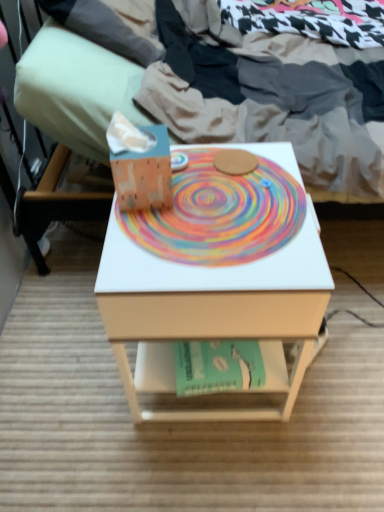
Question: Does matte green pillow at upper left contain rainbow painted paper at center?

Choices:
 (A) yes
 (B) no

Answer: (B)

Question: Does matte green pillow at upper left have a smaller size compared to rainbow painted paper at center?

Choices:
 (A) yes
 (B) no

Answer: (B)

Question: Is matte green pillow at upper left outside rainbow painted paper at center?

Choices:
 (A) yes
 (B) no

Answer: (A)

Question: From a real-world perspective, is matte green pillow at upper left positioned under rainbow painted paper at center based on gravity?

Choices:
 (A) no
 (B) yes

Answer: (A)

Question: Is matte green pillow at upper left positioned behind rainbow painted paper at center?

Choices:
 (A) yes
 (B) no

Answer: (A)

Question: Does matte green pillow at upper left appear on the right side of rainbow painted paper at center?

Choices:
 (A) no
 (B) yes

Answer: (A)

Question: Does matte white bed at center appear on the left side of rainbow painted paper at center?

Choices:
 (A) yes
 (B) no

Answer: (B)

Question: From the image's perspective, is matte white bed at center on top of rainbow painted paper at center?

Choices:
 (A) no
 (B) yes

Answer: (B)

Question: From the image's perspective, is matte white bed at center beneath rainbow painted paper at center?

Choices:
 (A) yes
 (B) no

Answer: (B)

Question: Is matte white bed at center next to rainbow painted paper at center?

Choices:
 (A) yes
 (B) no

Answer: (B)

Question: From a real-world perspective, is matte white bed at center under rainbow painted paper at center?

Choices:
 (A) yes
 (B) no

Answer: (A)

Question: Does matte white bed at center have a greater width compared to rainbow painted paper at center?

Choices:
 (A) yes
 (B) no

Answer: (A)

Question: Are matte green pillow at upper left and teal paper at center beside each other?

Choices:
 (A) yes
 (B) no

Answer: (B)